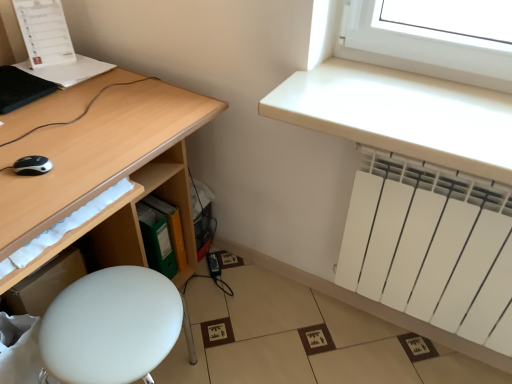
Locate an element on the screen. vacant location behind white matte stool at lower left is located at coordinates (215, 315).